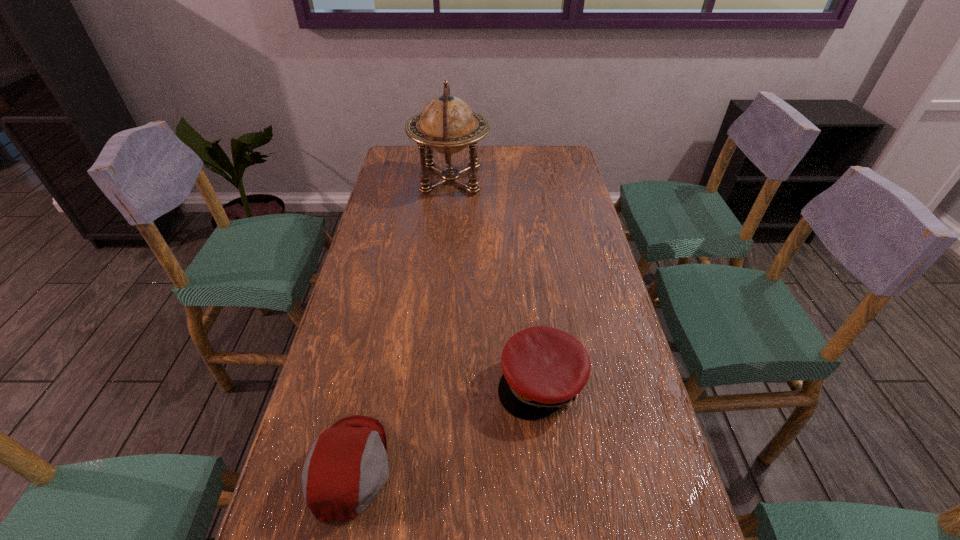
You are a GUI agent. You are given a task and a screenshot of the screen. Output one action in this format:
    pyautogui.click(x=<x>, y=<y>)
    Task: Click on the vacant space that's between the farthest object and the right cap
    The height and width of the screenshot is (540, 960).
    Given the screenshot: What is the action you would take?
    pyautogui.click(x=495, y=281)

Locate an element on the screen. free point between the left cap and the right cap is located at coordinates click(x=445, y=424).

You are a GUI agent. You are given a task and a screenshot of the screen. Output one action in this format:
    pyautogui.click(x=<x>, y=<y>)
    Task: Click on the free space between the right cap and the tallest object
    The image size is (960, 540).
    Given the screenshot: What is the action you would take?
    pyautogui.click(x=495, y=281)

The height and width of the screenshot is (540, 960). Find the location of `free space between the farthest object and the left cap`. free space between the farthest object and the left cap is located at coordinates [400, 323].

This screenshot has height=540, width=960. I want to click on free space between the left cap and the globe, so click(x=400, y=323).

Identify the location of vacant area that lies between the tallest object and the rightmost object. (495, 281).

Find the location of a particular element. free space between the rightmost object and the left cap is located at coordinates (445, 424).

Locate an element on the screen. object that is the second nearest to the rightmost object is located at coordinates (447, 124).

Where is `object that is the closest to the left cap`? object that is the closest to the left cap is located at coordinates (544, 368).

Identify the location of free region that satisfies the following two spatial constraints: 1. at the front of the rightmost object where the visor is located; 2. on the front-facing side of the left cap. (551, 467).